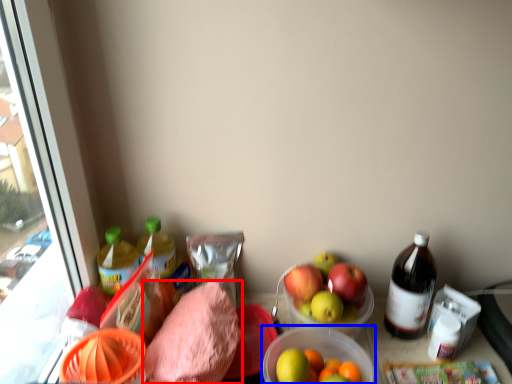
Question: Among these objects, which one is farthest to the camera, waste (highlighted by a red box) or bowl (highlighted by a blue box)?

Choices:
 (A) waste
 (B) bowl

Answer: (A)